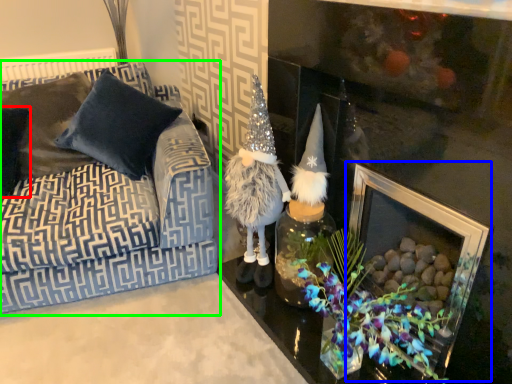
Question: Considering the real-world distances, which object is closest to pillow (highlighted by a red box)? picture frame (highlighted by a blue box) or studio couch (highlighted by a green box).

Choices:
 (A) picture frame
 (B) studio couch

Answer: (B)